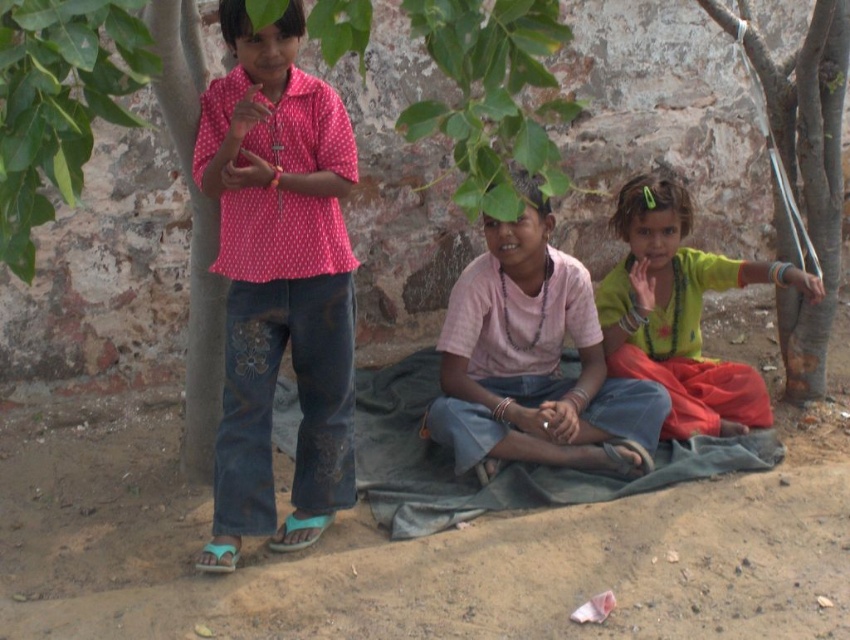
Question: Can you confirm if brown sandy ground at lower center is positioned above dark green fabric at lower center?

Choices:
 (A) yes
 (B) no

Answer: (B)

Question: Which point is closer to the camera?

Choices:
 (A) (775, 224)
 (B) (689, 211)

Answer: (B)

Question: Is pink cotton shirt at center wider than smooth bark tree trunk at right?

Choices:
 (A) no
 (B) yes

Answer: (B)

Question: Can you confirm if pink dotted shirt at center is bigger than pink cotton shirt at center?

Choices:
 (A) yes
 (B) no

Answer: (A)

Question: Which object is closer to the camera taking this photo?

Choices:
 (A) green leafy tree at upper left
 (B) pink dotted shirt at center
 (C) green fabric at right
 (D) pink cotton shirt at center

Answer: (A)

Question: Which of the following is the closest to the observer?

Choices:
 (A) (688, 438)
 (B) (496, 369)
 (C) (301, 492)

Answer: (C)